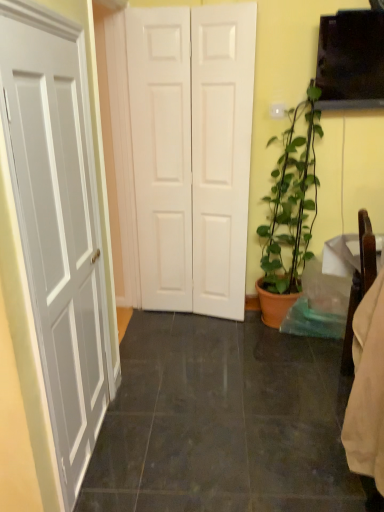
Question: Can you confirm if matte terracotta pot at right is positioned to the right of white matte door at center?

Choices:
 (A) yes
 (B) no

Answer: (A)

Question: Is matte terracotta pot at right wider than white matte door at center?

Choices:
 (A) no
 (B) yes

Answer: (B)

Question: Considering the relative sizes of matte terracotta pot at right and white matte door at center in the image provided, is matte terracotta pot at right taller than white matte door at center?

Choices:
 (A) yes
 (B) no

Answer: (B)

Question: Is there a large distance between matte terracotta pot at right and white matte door at center?

Choices:
 (A) no
 (B) yes

Answer: (A)

Question: Could white matte door at center be considered to be inside matte terracotta pot at right?

Choices:
 (A) no
 (B) yes

Answer: (A)

Question: In the image, is white matte door at center positioned in front of or behind black glossy tile at center?

Choices:
 (A) behind
 (B) front

Answer: (A)

Question: From the image's perspective, is white matte door at center above or below black glossy tile at center?

Choices:
 (A) below
 (B) above

Answer: (B)

Question: Looking at their shapes, would you say white matte door at center is wider or thinner than black glossy tile at center?

Choices:
 (A) wide
 (B) thin

Answer: (B)

Question: Would you say white matte door at center is inside or outside black glossy tile at center?

Choices:
 (A) outside
 (B) inside

Answer: (A)

Question: From a real-world perspective, is matte terracotta pot at right positioned above or below white matte door at center?

Choices:
 (A) below
 (B) above

Answer: (A)

Question: Is matte terracotta pot at right taller or shorter than white matte door at center?

Choices:
 (A) tall
 (B) short

Answer: (B)

Question: Based on their positions, is matte terracotta pot at right located to the left or right of white matte door at center?

Choices:
 (A) left
 (B) right

Answer: (B)

Question: Considering the positions of point coord(291,233) and point coord(220,35), is point coord(291,233) closer or farther from the camera than point coord(220,35)?

Choices:
 (A) closer
 (B) farther

Answer: (B)

Question: In terms of width, does black glossy tile at center look wider or thinner when compared to white matte door at center?

Choices:
 (A) wide
 (B) thin

Answer: (A)

Question: From the image's perspective, is black glossy tile at center located above or below white matte door at center?

Choices:
 (A) below
 (B) above

Answer: (A)